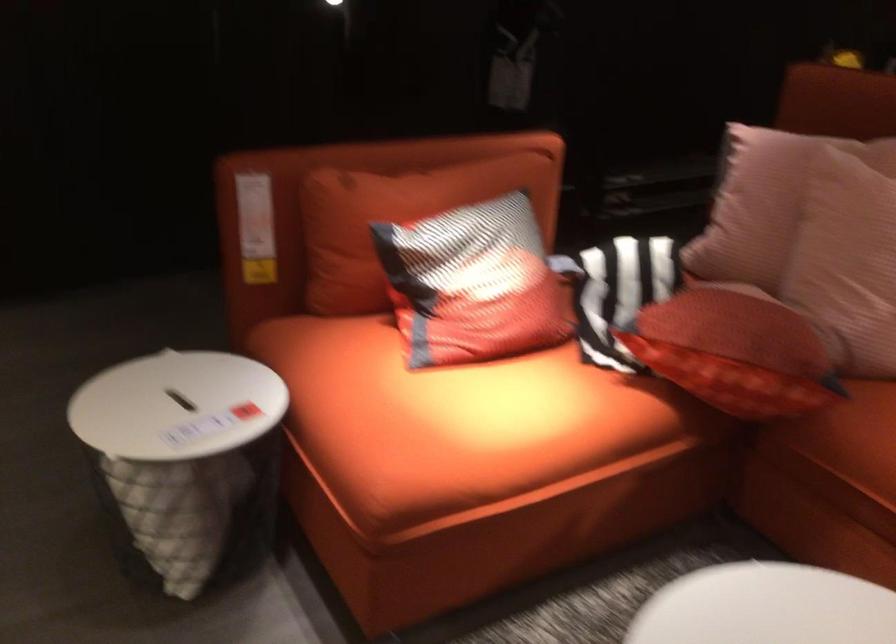
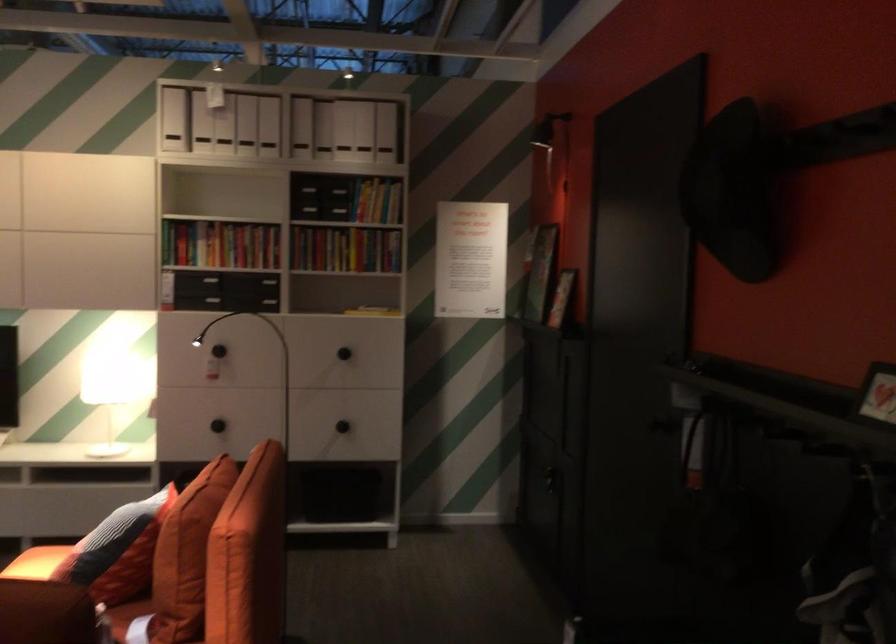
In the second image, find the point that corresponds to point 545,183 in the first image.

(186, 554)